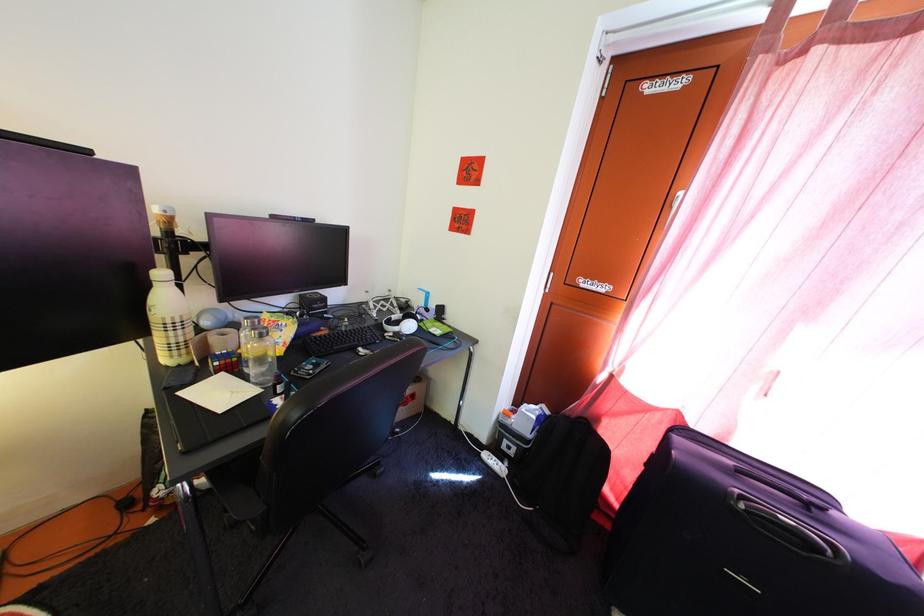
Where is `clear drinking glass`? This screenshot has height=616, width=924. clear drinking glass is located at coordinates (261, 357).